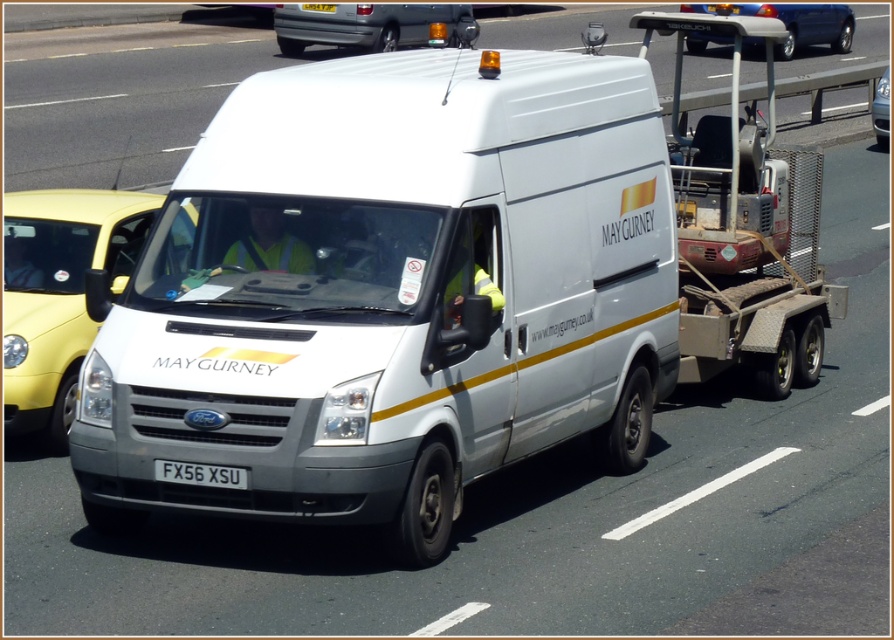
Is white glossy taxi at left to the left of white plastic license plate at center from the viewer's perspective?

Indeed, white glossy taxi at left is positioned on the left side of white plastic license plate at center.

Does white glossy taxi at left have a lesser width compared to white plastic license plate at center?

In fact, white glossy taxi at left might be wider than white plastic license plate at center.

Which is in front, point (49, 284) or point (190, 474)?

Point (190, 474)

The width and height of the screenshot is (894, 640). I want to click on white glossy taxi at left, so click(58, 292).

Can you confirm if white matte van at center is positioned below silver metallic van at center?

Correct, white matte van at center is located below silver metallic van at center.

Which of these two, white matte van at center or silver metallic van at center, stands shorter?

With less height is silver metallic van at center.

Is point (357, 419) more distant than point (350, 32)?

No, it is not.

The height and width of the screenshot is (640, 894). Identify the location of white matte van at center. (389, 292).

Is white matte van at center above metallic blue car at upper center?

No.

Is white matte van at center in front of metallic blue car at upper center?

Yes, white matte van at center is closer to the viewer.

Between point (115, 532) and point (832, 35), which one is positioned behind?

The point (832, 35) is behind.

Locate an element on the screen. white matte van at center is located at coordinates (389, 292).